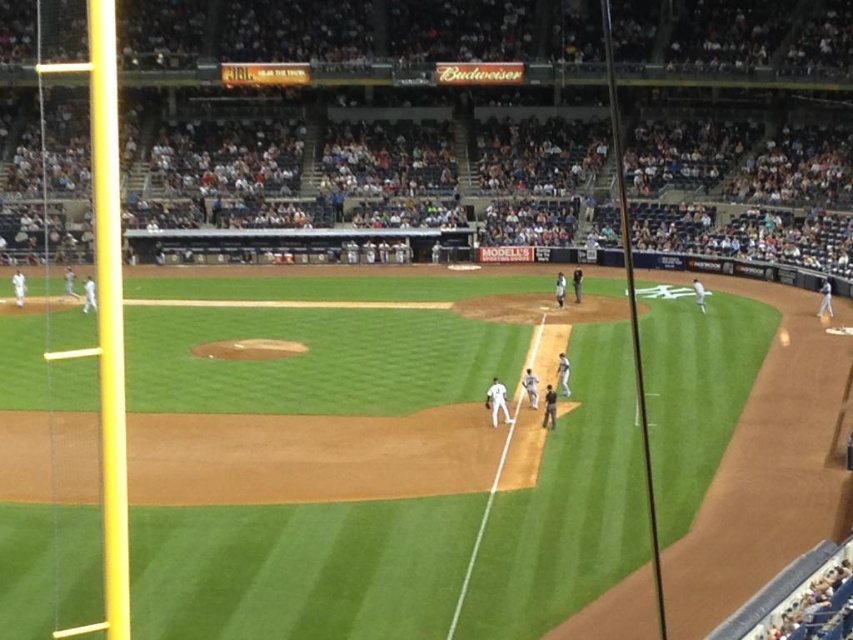
You are a photographer trying to capture a wide shot of the white matte uniform at center and the dark gray seats at upper center. Which object would you need to frame more carefully to ensure it fits within the camera viewfinder?

The dark gray seats at upper center might be wider than the white matte uniform at center, so you should frame the dark gray seats at upper center more carefully to ensure it fits within the camera viewfinder.

You are a photographer standing at the edge of the baseball field. You want to take a photo that includes both the point at coordinates point (698,189) and point (506,408). Based on their positions, which point is closer to your camera lens?

Point (506,408) is closer to the camera lens because the point (698,189) is further away from the viewer according to the spatial description provided.

You are a photographer at the stadium and want to capture both the dark gray seats at upper center and the white matte uniform at center in a single shot. Which object should you focus on first to ensure both are in frame?

The dark gray seats at upper center is bigger than the white matte uniform at center, so you should focus on the dark gray seats at upper center first to ensure both are in frame.